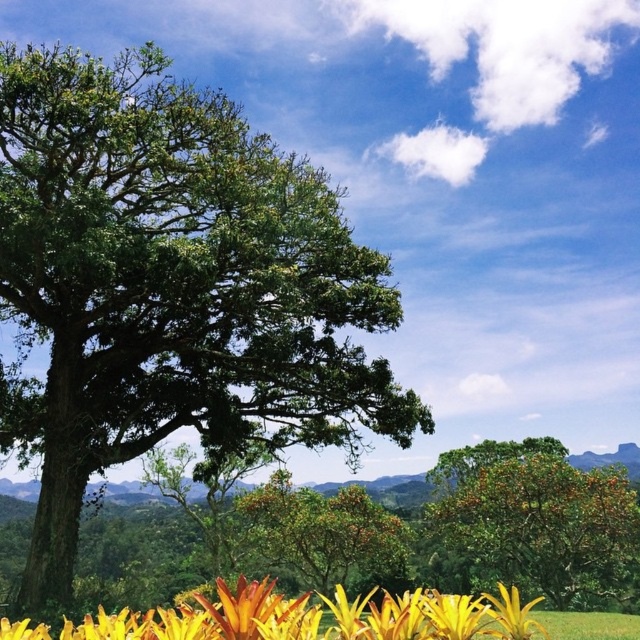
Question: Can you confirm if green leafy oak tree at left is thinner than yellow-green grass at lower center?

Choices:
 (A) no
 (B) yes

Answer: (A)

Question: Can you confirm if orange matte tree at center is positioned above yellow matte flower at lower center?

Choices:
 (A) yes
 (B) no

Answer: (B)

Question: From the image, what is the correct spatial relationship of green leafy oak tree at left in relation to yellow matte flower at lower center?

Choices:
 (A) left
 (B) right

Answer: (A)

Question: Considering the real-world distances, which object is farthest from the yellow matte flower at lower center?

Choices:
 (A) green leafy oak tree at left
 (B) yellow-green grass at lower center

Answer: (A)

Question: Among these objects, which one is nearest to the camera?

Choices:
 (A) yellow matte flower at lower center
 (B) orange matte tree at center

Answer: (A)

Question: Among these objects, which one is nearest to the camera?

Choices:
 (A) green leafy oak tree at left
 (B) yellow matte flower at lower center
 (C) orange matte tree at center

Answer: (B)